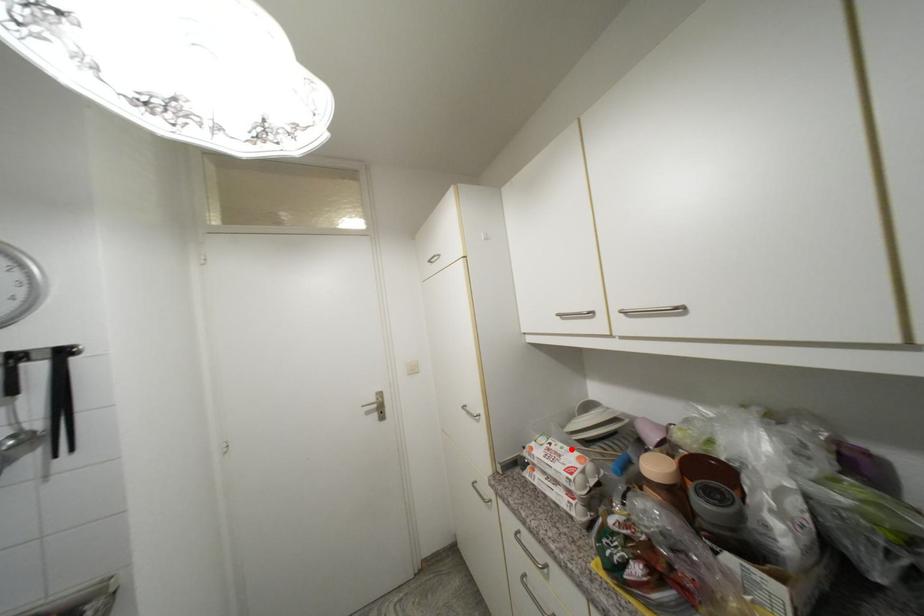
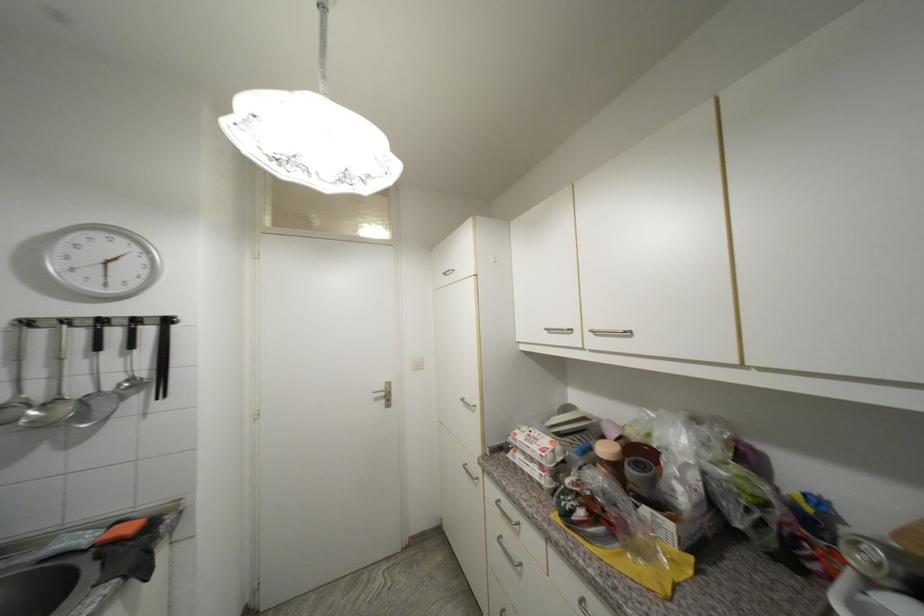
Where in the second image is the point corresponding to the highlighted location from the first image?

(548, 436)